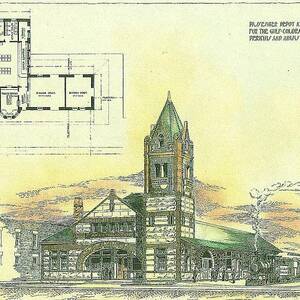
Identify the location of chimney. (79, 206).